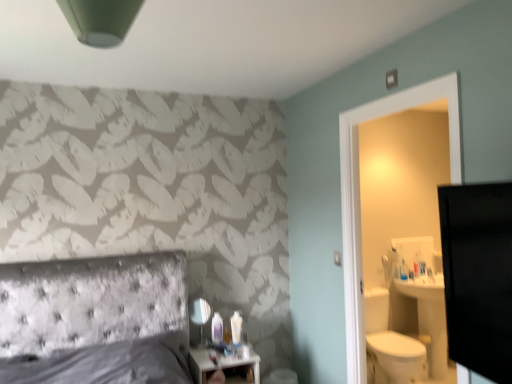
In order to click on matte glass mirror at center in this screenshot , I will do `click(200, 313)`.

Where is `matte glass mirror at center`? matte glass mirror at center is located at coordinates (200, 313).

Looking at the image, does matte glass mirror at center seem bigger or smaller compared to white plastic lotion at center?

Considering their sizes, matte glass mirror at center takes up more space than white plastic lotion at center.

Is point (205, 312) more distant than point (240, 320)?

No, (205, 312) is in front of (240, 320).

Which of these two, matte glass mirror at center or white plastic lotion at center, stands shorter?

white plastic lotion at center is shorter.

Is matte glass mirror at center located outside white plastic lotion at center?

Indeed, matte glass mirror at center is completely outside white plastic lotion at center.

Which of these two, white glossy nightstand at lower center or white plastic lotion at center, is wider?

white glossy nightstand at lower center.

From the image's perspective, between white glossy nightstand at lower center and white plastic lotion at center, which one is located above?

From the image's view, white plastic lotion at center is above.

Considering the positions of point (204, 371) and point (232, 334), is point (204, 371) closer or farther from the camera than point (232, 334)?

Point (204, 371) is positioned closer to the camera compared to point (232, 334).

Is white glossy nightstand at lower center facing towards white plastic lotion at center?

No, white glossy nightstand at lower center is not facing towards white plastic lotion at center.

What's the angular difference between white plastic lotion at center and matte glass mirror at center's facing directions?

There is a 10.6-degree angle between the facing directions of white plastic lotion at center and matte glass mirror at center.

Between point (239, 335) and point (199, 324), which one is positioned behind?

Positioned behind is point (239, 335).

Based on the photo, does white plastic lotion at center have a larger size compared to matte glass mirror at center?

No, white plastic lotion at center is not bigger than matte glass mirror at center.

This screenshot has width=512, height=384. Identify the location of mirror located above the white plastic lotion at center (from a real-world perspective). (200, 313).

Considering the relative positions of white glossy nightstand at lower center and matte glass mirror at center in the image provided, is white glossy nightstand at lower center to the left of matte glass mirror at center from the viewer's perspective?

No.

Considering the sizes of objects white glossy nightstand at lower center and matte glass mirror at center in the image provided, who is wider, white glossy nightstand at lower center or matte glass mirror at center?

white glossy nightstand at lower center.

Is white glossy nightstand at lower center oriented away from matte glass mirror at center?

white glossy nightstand at lower center does not have its back to matte glass mirror at center.

This screenshot has width=512, height=384. Find the location of `nightstand in front of the matte glass mirror at center`. nightstand in front of the matte glass mirror at center is located at coordinates (200, 363).

Considering the relative sizes of matte glass mirror at center and white glossy nightstand at lower center in the image provided, is matte glass mirror at center bigger than white glossy nightstand at lower center?

Incorrect, matte glass mirror at center is not larger than white glossy nightstand at lower center.

From the image's perspective, is matte glass mirror at center over white glossy nightstand at lower center?

Yes, from the image's perspective, matte glass mirror at center is above white glossy nightstand at lower center.

In the image, is matte glass mirror at center positioned in front of or behind white glossy nightstand at lower center?

In the image, matte glass mirror at center appears behind white glossy nightstand at lower center.

Which of these two, white plastic lotion at center or white glossy nightstand at lower center, stands shorter?

Standing shorter between the two is white plastic lotion at center.

From the image's perspective, is white plastic lotion at center above or below white glossy nightstand at lower center?

white plastic lotion at center is situated higher than white glossy nightstand at lower center in the image.

The height and width of the screenshot is (384, 512). In order to click on toiletry located behind the white glossy nightstand at lower center in this screenshot , I will do `click(236, 328)`.

The image size is (512, 384). I want to click on toiletry that is under the matte glass mirror at center (from a real-world perspective), so [x=236, y=328].

This screenshot has width=512, height=384. What are the coordinates of `nightstand below the white plastic lotion at center (from the image's perspective)` in the screenshot? It's located at (200, 363).

Which object lies nearer to the anchor point white plastic lotion at center, matte glass mirror at center or white glossy nightstand at lower center?

white glossy nightstand at lower center lies closer to white plastic lotion at center than the other object.

When comparing their distances from matte glass mirror at center, does white plastic lotion at center or white glossy nightstand at lower center seem further?

Among the two, white plastic lotion at center is located further to matte glass mirror at center.

Based on their spatial positions, is matte glass mirror at center or white plastic lotion at center closer to white glossy nightstand at lower center?

white plastic lotion at center is positioned closer to the anchor white glossy nightstand at lower center.

When comparing their distances from matte glass mirror at center, does white glossy nightstand at lower center or white plastic lotion at center seem further?

white plastic lotion at center.

Considering their positions, is white plastic lotion at center positioned further to white glossy nightstand at lower center than matte glass mirror at center?

Among the two, matte glass mirror at center is located further to white glossy nightstand at lower center.

Estimate the real-world distances between objects in this image. Which object is closer to white plastic lotion at center, white glossy nightstand at lower center or matte glass mirror at center?

white glossy nightstand at lower center is closer to white plastic lotion at center.

At what (x,y) coordinates should I click in order to perform the action: click on mirror located between white glossy nightstand at lower center and white plastic lotion at center in the depth direction. Please return your answer as a coordinate pair (x, y). The height and width of the screenshot is (384, 512). Looking at the image, I should click on (200, 313).